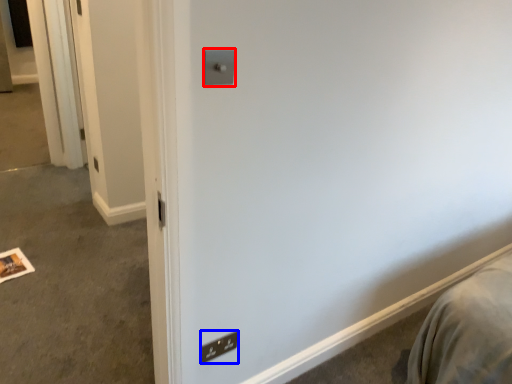
Question: Which object is closer to the camera taking this photo, light switch (highlighted by a red box) or light switch (highlighted by a blue box)?

Choices:
 (A) light switch
 (B) light switch

Answer: (A)